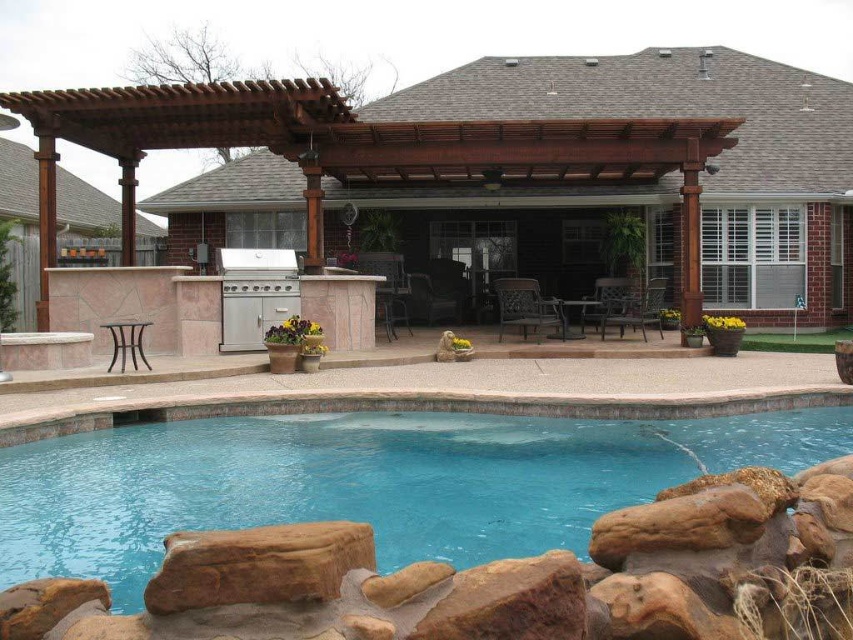
Measure the distance between brown wood pergola at center and blue smooth water at center.

brown wood pergola at center and blue smooth water at center are 30.44 feet apart from each other.

Locate an element on the screen. This screenshot has width=853, height=640. brown wood pergola at center is located at coordinates (621, 172).